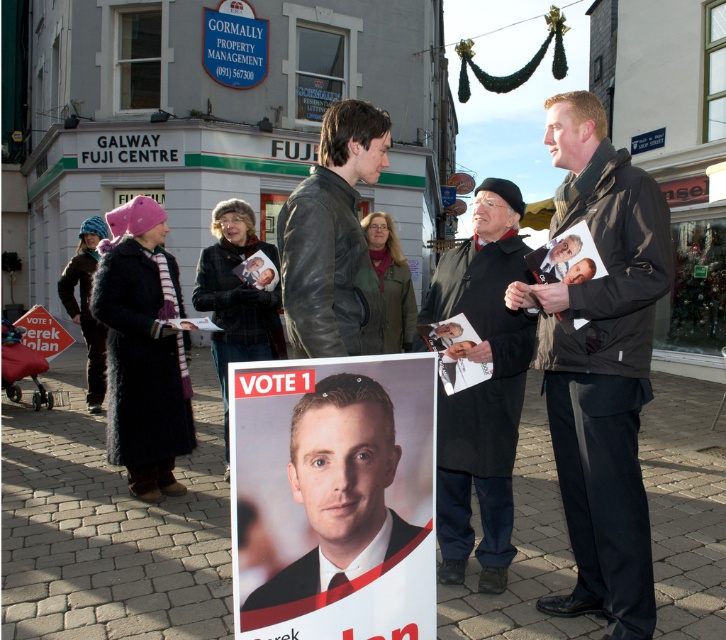
Between white paper poster at center and blue knitted hat at left, which one has more height?

blue knitted hat at left is taller.

Which is above, white paper poster at center or blue knitted hat at left?

blue knitted hat at left is above.

Who is more forward, [351,422] or [105,353]?

Point [351,422]

Identify the location of white paper poster at center. Image resolution: width=726 pixels, height=640 pixels. (333, 497).

Who is more forward, (x=266, y=45) or (x=444, y=378)?

Positioned in front is point (x=444, y=378).

Does blue plastic sign at upper center have a greater width compared to matte paper poster at center?

Yes.

Find the location of a particular element. The height and width of the screenshot is (640, 726). blue plastic sign at upper center is located at coordinates point(234,44).

Does point (583, 346) lie behind point (70, 339)?

No.

Which is behind, point (619, 172) or point (65, 333)?

Positioned behind is point (65, 333).

This screenshot has height=640, width=726. I want to click on dark brown leather jacket at center, so click(600, 364).